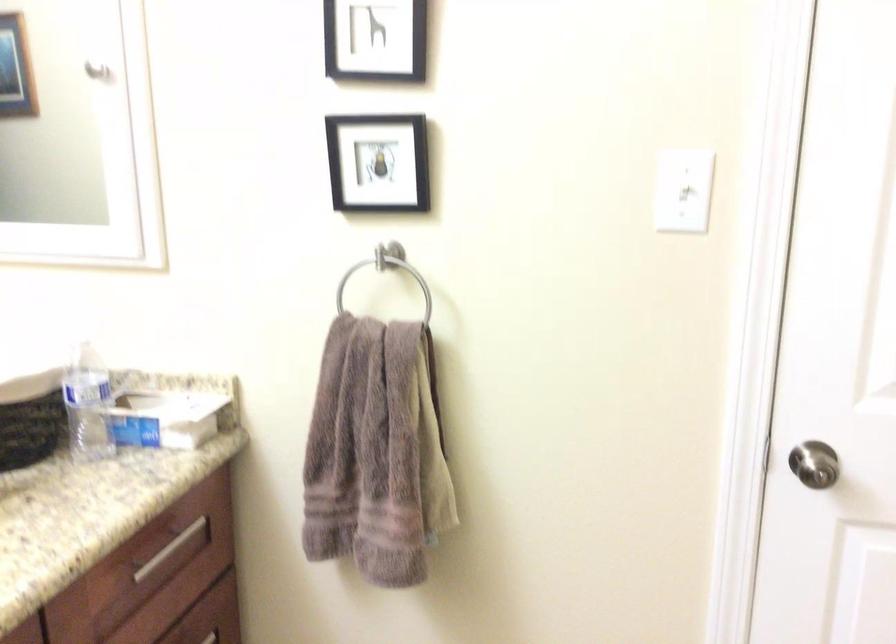
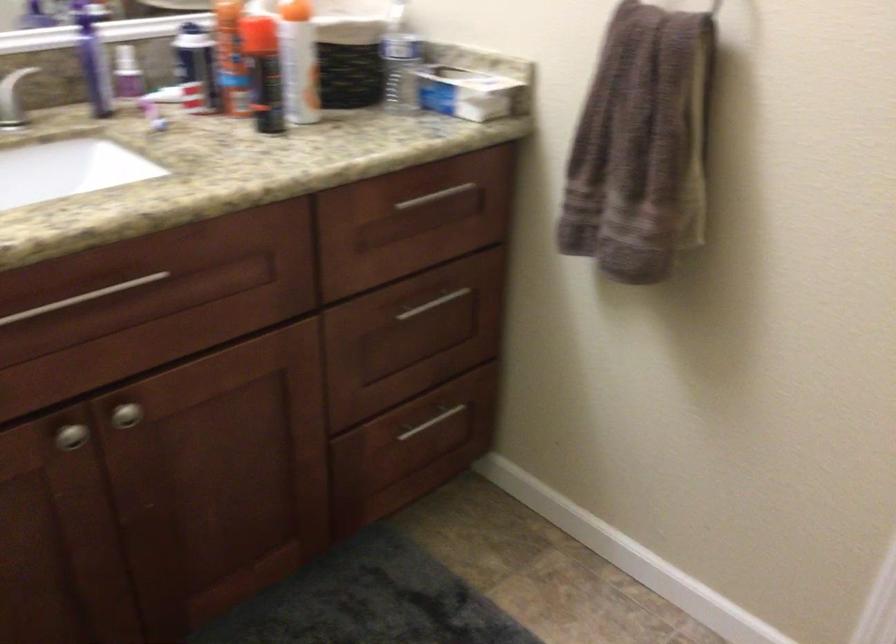
Where in the second image is the point corresponding to (183,420) from the first image?

(470, 91)